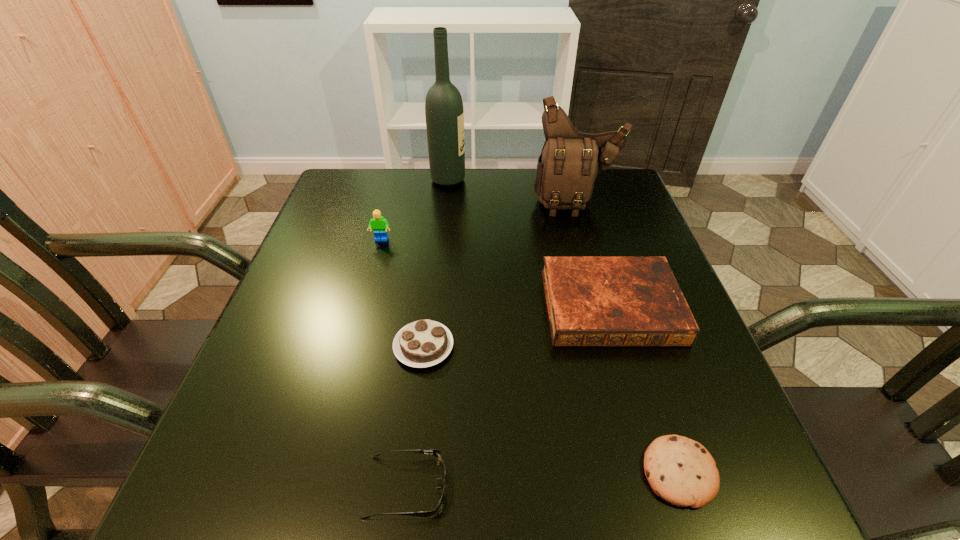
This screenshot has height=540, width=960. What are the coordinates of `shoulder bag that is at the right edge` in the screenshot? It's located at (570, 161).

At what (x,y) coordinates should I click in order to perform the action: click on Bible that is positioned at the right edge. Please return your answer as a coordinate pair (x, y). Looking at the image, I should click on (592, 301).

Where is `cookie positioned at the right edge`? The width and height of the screenshot is (960, 540). cookie positioned at the right edge is located at coordinates (681, 471).

Where is `object present at the far right corner`? This screenshot has height=540, width=960. object present at the far right corner is located at coordinates (570, 161).

This screenshot has height=540, width=960. What are the coordinates of `object that is at the near right corner` in the screenshot? It's located at tap(681, 471).

Where is `vacant space at the far edge of the desktop`? vacant space at the far edge of the desktop is located at coordinates (540, 207).

The height and width of the screenshot is (540, 960). In order to click on vacant region at the near edge of the desktop in this screenshot , I will do `click(386, 478)`.

At what (x,y) coordinates should I click in order to perform the action: click on vacant space at the left edge of the desktop. Please return your answer as a coordinate pair (x, y). This screenshot has width=960, height=540. Looking at the image, I should click on (325, 411).

You are a GUI agent. You are given a task and a screenshot of the screen. Output one action in this format:
    pyautogui.click(x=<x>, y=<y>)
    Task: Click on the vacant space at the right edge of the desktop
    
    Given the screenshot: What is the action you would take?
    pyautogui.click(x=602, y=240)

Find the location of a particular element. This screenshot has width=960, height=540. vacant space at the far left corner of the desktop is located at coordinates (340, 193).